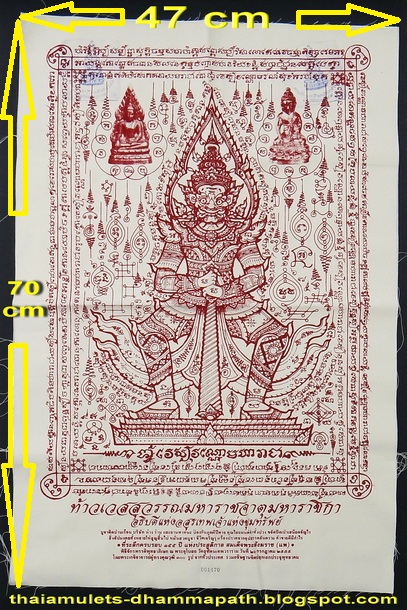
The image size is (407, 610). Find the location of `ornaments`. ornaments is located at coordinates (101, 109), (321, 243), (301, 223), (292, 194), (134, 232), (113, 228), (104, 280), (89, 230), (315, 271).